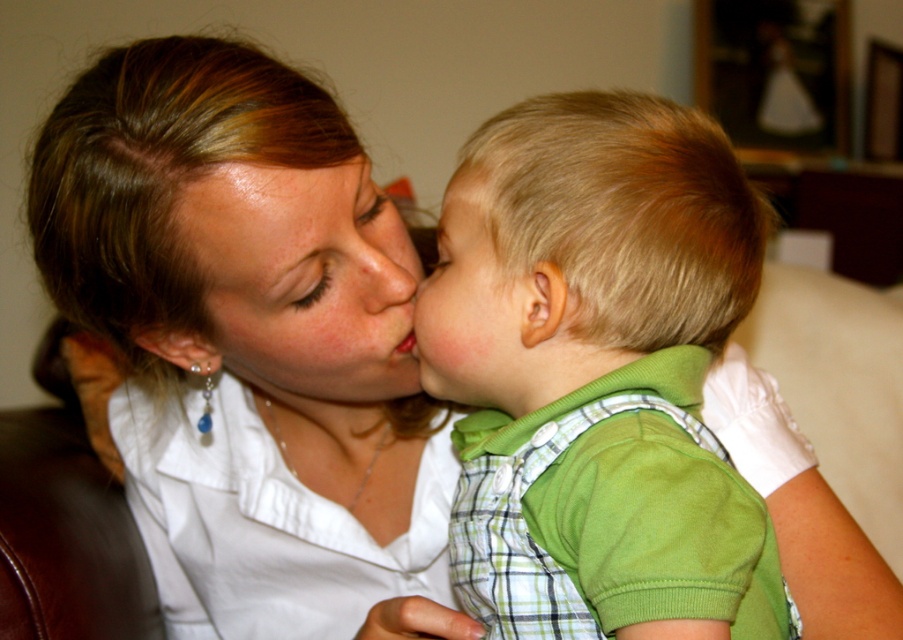
Can you confirm if green plaid overalls at center is positioned to the left of matte green shirt at center?

In fact, green plaid overalls at center is to the right of matte green shirt at center.

Which is more to the left, green plaid overalls at center or matte green shirt at center?

matte green shirt at center

Is point (751, 596) behind point (509, 380)?

No, it is not.

Locate an element on the screen. The image size is (903, 640). green plaid overalls at center is located at coordinates (601, 371).

Who is more forward, (349,291) or (452,180)?

Point (452,180) is in front.

Does point (419, 259) come farther from viewer compared to point (481, 186)?

Yes.

The image size is (903, 640). I want to click on smooth skin nose at center, so click(383, 269).

Does point (682, 440) come behind point (476, 179)?

No, it is not.

Which is below, green plaid overalls at center or blonde hair at center?

green plaid overalls at center is lower down.

Describe the element at coordinates (601, 371) in the screenshot. I see `green plaid overalls at center` at that location.

At what (x,y) coordinates should I click in order to perform the action: click on green plaid overalls at center. Please return your answer as a coordinate pair (x, y). This screenshot has width=903, height=640. Looking at the image, I should click on (601, 371).